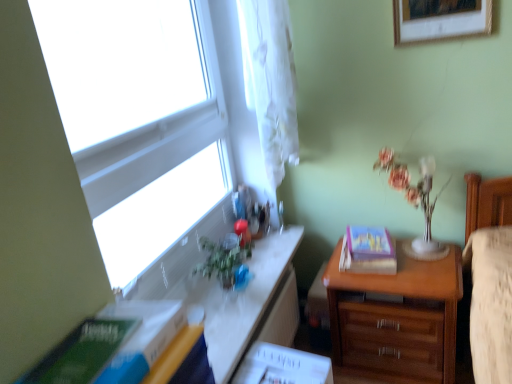
Question: Is wooden picture frame at upper right surrounded by translucent glass vase at upper right?

Choices:
 (A) yes
 (B) no

Answer: (B)

Question: Can you confirm if translucent glass vase at upper right is taller than wooden picture frame at upper right?

Choices:
 (A) no
 (B) yes

Answer: (B)

Question: Does translucent glass vase at upper right have a smaller size compared to wooden picture frame at upper right?

Choices:
 (A) no
 (B) yes

Answer: (A)

Question: Does translucent glass vase at upper right appear on the left side of wooden picture frame at upper right?

Choices:
 (A) yes
 (B) no

Answer: (A)

Question: Can you confirm if translucent glass vase at upper right is wider than wooden picture frame at upper right?

Choices:
 (A) no
 (B) yes

Answer: (B)

Question: Do you think hardcover book at right, which is the second paperback book in front-to-back order, is within wooden chest of drawers at right, or outside of it?

Choices:
 (A) inside
 (B) outside

Answer: (A)

Question: From a real-world perspective, is hardcover book at right, arranged as the 2th paperback book when viewed from the left, positioned above or below wooden chest of drawers at right?

Choices:
 (A) above
 (B) below

Answer: (A)

Question: Does point 387,253 appear closer or farther from the camera than point 332,324?

Choices:
 (A) closer
 (B) farther

Answer: (A)

Question: From their relative heights in the image, would you say hardcover book at right, which appears as the first paperback book when viewed from the right, is taller or shorter than wooden chest of drawers at right?

Choices:
 (A) short
 (B) tall

Answer: (A)

Question: Is white glossy table at upper left inside or outside of translucent glass vase at upper right?

Choices:
 (A) outside
 (B) inside

Answer: (A)

Question: In terms of height, does white glossy table at upper left look taller or shorter compared to translucent glass vase at upper right?

Choices:
 (A) tall
 (B) short

Answer: (B)

Question: In the image, is white glossy table at upper left positioned in front of or behind translucent glass vase at upper right?

Choices:
 (A) behind
 (B) front

Answer: (B)

Question: In the image, is white glossy table at upper left on the left side or the right side of translucent glass vase at upper right?

Choices:
 (A) right
 (B) left

Answer: (B)

Question: Is white glossy table at upper left situated inside wooden picture frame at upper right or outside?

Choices:
 (A) outside
 (B) inside

Answer: (A)

Question: Is white glossy table at upper left taller or shorter than wooden picture frame at upper right?

Choices:
 (A) tall
 (B) short

Answer: (B)